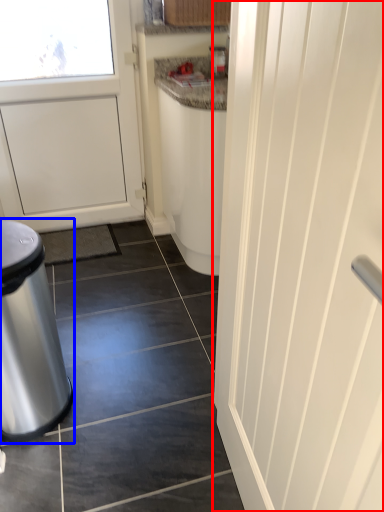
Question: Which object is further to the camera taking this photo, door (highlighted by a red box) or waste container (highlighted by a blue box)?

Choices:
 (A) door
 (B) waste container

Answer: (B)